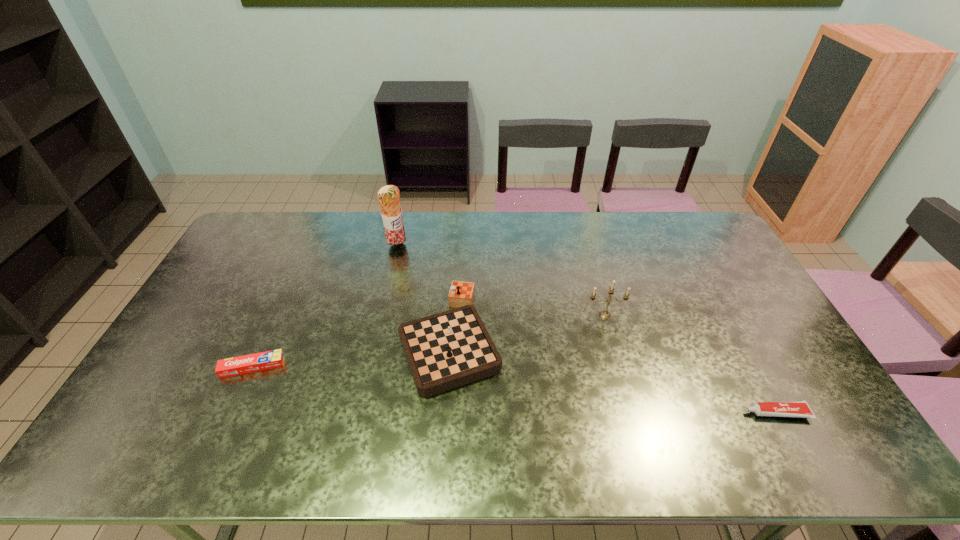
This screenshot has height=540, width=960. Identify the location of free space located 0.150m on the front of the farthest object. (389, 281).

Find the location of a particular element. This screenshot has width=960, height=540. vacant position located 0.240m on the front of the second object from right to left is located at coordinates point(625,386).

Where is `free space located 0.110m on the right of the third object from right to left`? This screenshot has width=960, height=540. free space located 0.110m on the right of the third object from right to left is located at coordinates (538, 339).

The width and height of the screenshot is (960, 540). Find the location of `free location located 0.140m at the nozzle of the nearest object`. free location located 0.140m at the nozzle of the nearest object is located at coordinates (689, 413).

This screenshot has width=960, height=540. I want to click on free region located 0.310m at the nozzle of the nearest object, so click(x=623, y=413).

What are the coordinates of `free location located 0.210m at the nozzle of the nearest object` in the screenshot? It's located at (662, 413).

Find the location of a particular element. Image resolution: width=960 pixels, height=540 pixels. free region located 0.280m on the back of the left toothpaste is located at coordinates (289, 287).

This screenshot has width=960, height=540. Identify the location of object positioned at the far edge. (388, 196).

You are a GUI agent. You are given a task and a screenshot of the screen. Output one action in this format:
    pyautogui.click(x=<x>, y=<y>)
    Task: Click on the object that is positioned at the right edge
    The width and height of the screenshot is (960, 540).
    Given the screenshot: What is the action you would take?
    pyautogui.click(x=801, y=409)

The width and height of the screenshot is (960, 540). I want to click on vacant space at the far edge, so click(608, 231).